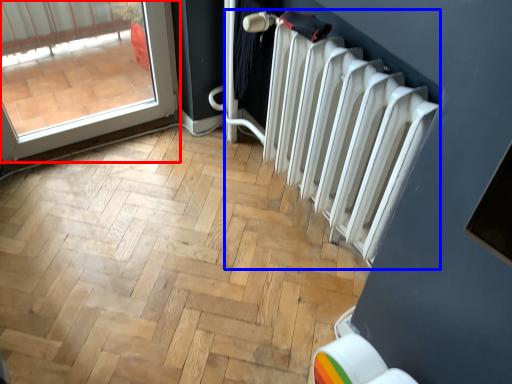
Question: Which of the following is the closest to the observer, door (highlighted by a red box) or radiator (highlighted by a blue box)?

Choices:
 (A) door
 (B) radiator

Answer: (B)